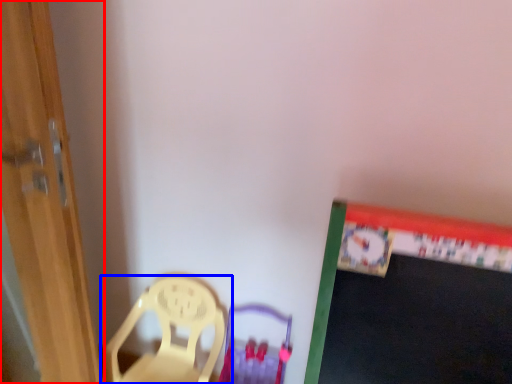
Question: Which object is further to the camera taking this photo, door (highlighted by a red box) or chair (highlighted by a blue box)?

Choices:
 (A) door
 (B) chair

Answer: (B)